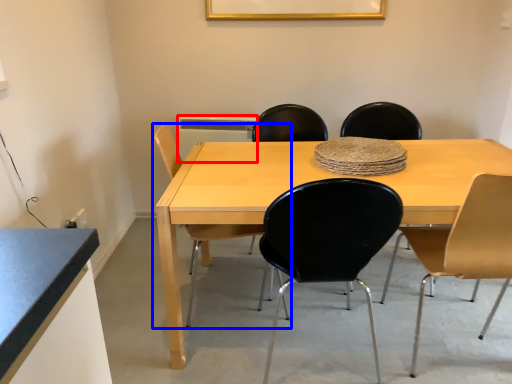
Question: Among these objects, which one is farthest to the camera, appliance (highlighted by a red box) or chair (highlighted by a blue box)?

Choices:
 (A) appliance
 (B) chair

Answer: (A)